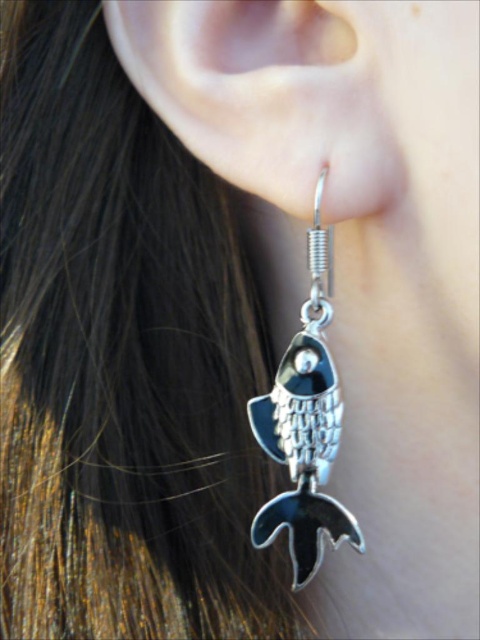
Question: Among these points, which one is nearest to the camera?

Choices:
 (A) (320, 113)
 (B) (289, 467)

Answer: (A)

Question: Which of the following is the closest to the observer?

Choices:
 (A) (308, 374)
 (B) (240, 12)

Answer: (B)

Question: Can you confirm if silver metallic earring at center is positioned above silver metallic fish at lower left?

Choices:
 (A) yes
 (B) no

Answer: (A)

Question: Can you confirm if silver metallic earring at center is thinner than silver metallic fish at lower left?

Choices:
 (A) yes
 (B) no

Answer: (B)

Question: Among these objects, which one is farthest from the camera?

Choices:
 (A) silver metallic fish at lower left
 (B) silver metallic earring at center

Answer: (A)

Question: Is silver metallic earring at center further to the viewer compared to silver metallic fish at lower left?

Choices:
 (A) no
 (B) yes

Answer: (A)